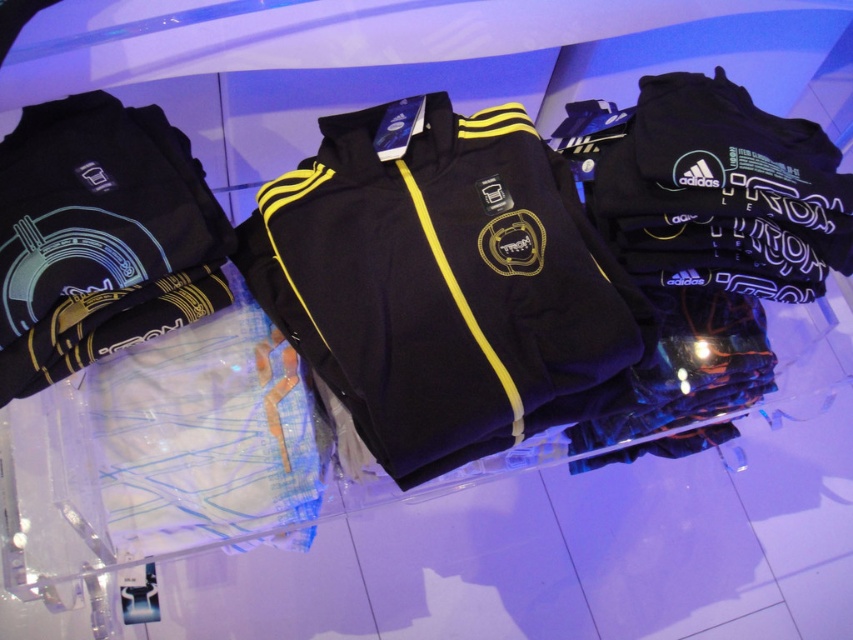
Question: Which point appears farthest from the camera in this image?

Choices:
 (A) (567, 244)
 (B) (242, 518)
 (C) (201, 243)

Answer: (B)

Question: Which point is farther to the camera?

Choices:
 (A) matte black track pants at center
 (B) glowing blue fabric at left
 (C) matte black jacket at center

Answer: (A)

Question: Where is glowing blue fabric at left located in relation to matte black track pants at center in the image?

Choices:
 (A) below
 (B) above

Answer: (B)

Question: Which point is closer to the camera taking this photo?

Choices:
 (A) (86, 154)
 (B) (296, 515)

Answer: (A)

Question: Does matte black jacket at center have a greater width compared to glowing blue fabric at left?

Choices:
 (A) yes
 (B) no

Answer: (A)

Question: Can you confirm if glowing blue fabric at left is positioned to the left of matte black track pants at center?

Choices:
 (A) no
 (B) yes

Answer: (B)